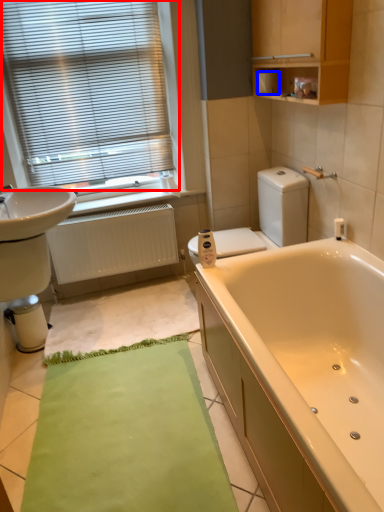
Question: Which point is further to the camera, window blind (highlighted by a red box) or toilet paper (highlighted by a blue box)?

Choices:
 (A) window blind
 (B) toilet paper

Answer: (B)